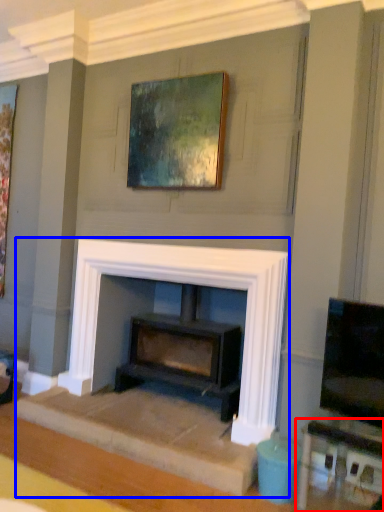
Question: Which object appears farthest to the camera in this image, table (highlighted by a red box) or fireplace (highlighted by a blue box)?

Choices:
 (A) table
 (B) fireplace

Answer: (B)